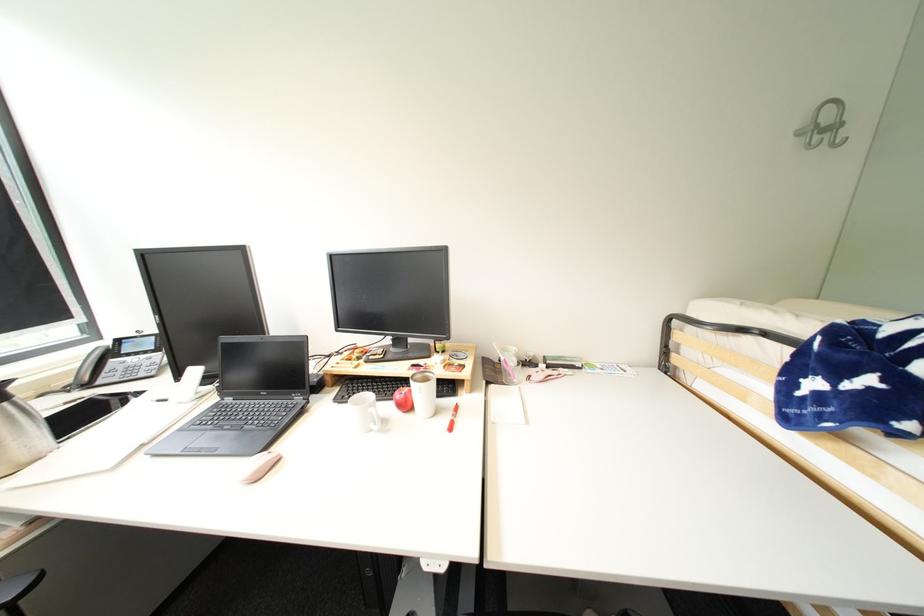
The location [363,411] corresponds to which object?

It refers to a clear glass cup.